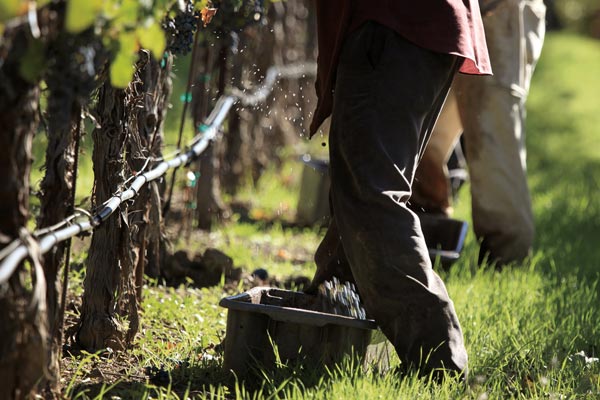
The height and width of the screenshot is (400, 600). I want to click on bin 2, so click(449, 229).